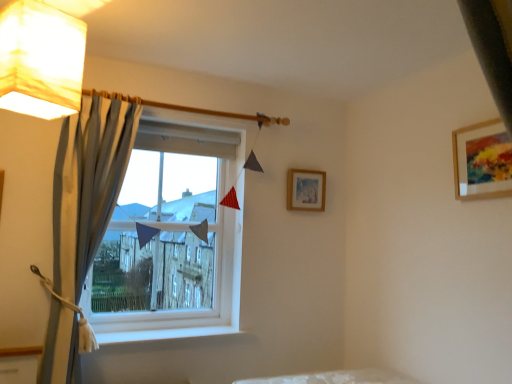
Question: Is white smooth window sill at lower center at the back of white plastic window at center?

Choices:
 (A) no
 (B) yes

Answer: (A)

Question: Can you see white plastic window at center touching white smooth window sill at lower center?

Choices:
 (A) yes
 (B) no

Answer: (B)

Question: From a real-world perspective, is white plastic window at center positioned under white smooth window sill at lower center based on gravity?

Choices:
 (A) no
 (B) yes

Answer: (A)

Question: Is white plastic window at center wider than white smooth window sill at lower center?

Choices:
 (A) yes
 (B) no

Answer: (B)

Question: Is white plastic window at center at the left side of white smooth window sill at lower center?

Choices:
 (A) no
 (B) yes

Answer: (B)

Question: From a real-world perspective, relative to blue striped curtain at left, is white paper lampshade at upper left vertically above or below?

Choices:
 (A) below
 (B) above

Answer: (B)

Question: Looking at their shapes, would you say white paper lampshade at upper left is wider or thinner than blue striped curtain at left?

Choices:
 (A) thin
 (B) wide

Answer: (B)

Question: Does point (66, 99) appear closer or farther from the camera than point (66, 362)?

Choices:
 (A) closer
 (B) farther

Answer: (A)

Question: Based on their positions, is white paper lampshade at upper left located to the left or right of blue striped curtain at left?

Choices:
 (A) left
 (B) right

Answer: (B)

Question: In terms of height, does white plastic window at center look taller or shorter compared to blue striped curtain at left?

Choices:
 (A) short
 (B) tall

Answer: (A)

Question: From a real-world perspective, is white plastic window at center above or below blue striped curtain at left?

Choices:
 (A) below
 (B) above

Answer: (B)

Question: Considering the positions of white plastic window at center and blue striped curtain at left in the image, is white plastic window at center bigger or smaller than blue striped curtain at left?

Choices:
 (A) big
 (B) small

Answer: (B)

Question: Would you say white plastic window at center is inside or outside blue striped curtain at left?

Choices:
 (A) outside
 (B) inside

Answer: (A)

Question: Considering the positions of point (486, 165) and point (96, 339), is point (486, 165) closer or farther from the camera than point (96, 339)?

Choices:
 (A) farther
 (B) closer

Answer: (B)

Question: Based on their sizes in the image, would you say wooden-framed artwork at upper right, positioned as the second picture frame in left-to-right order, is bigger or smaller than white smooth window sill at lower center?

Choices:
 (A) small
 (B) big

Answer: (B)